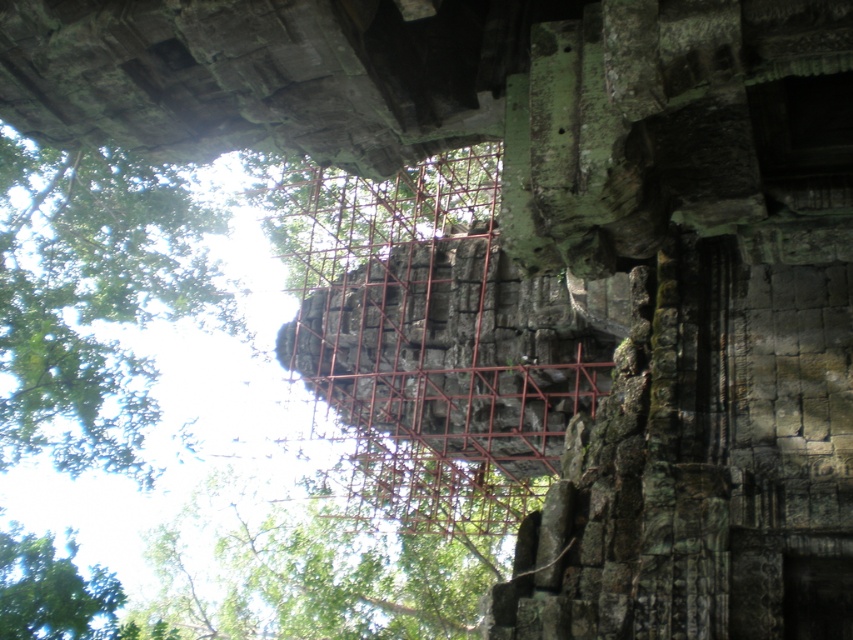
You are a visitor standing at the entrance of the temple. You see a green leafy tree at upper left and a green stone structure at center. Which object is positioned more to the left side of the image?

The green leafy tree at upper left is positioned more to the left side of the image compared to the green stone structure at center.

Based on the photo, you are a drone operator tasked with capturing aerial footage of the ancient stone structure. Your drone is currently at the center of the image. To avoid collision, you need to fly the drone to the green leafy tree at upper left. What direction should you steer the drone to reach the tree?

The green leafy tree at upper left is located at coordinates point (x=91, y=296), so you should steer the drone to the upper left direction to reach the tree.

You are standing in front of the ancient stone structure and notice a point marked at coordinates (91, 296). Based on the scene description, what object is located at this point?

The point at coordinates (91, 296) corresponds to the green leafy tree at upper left.